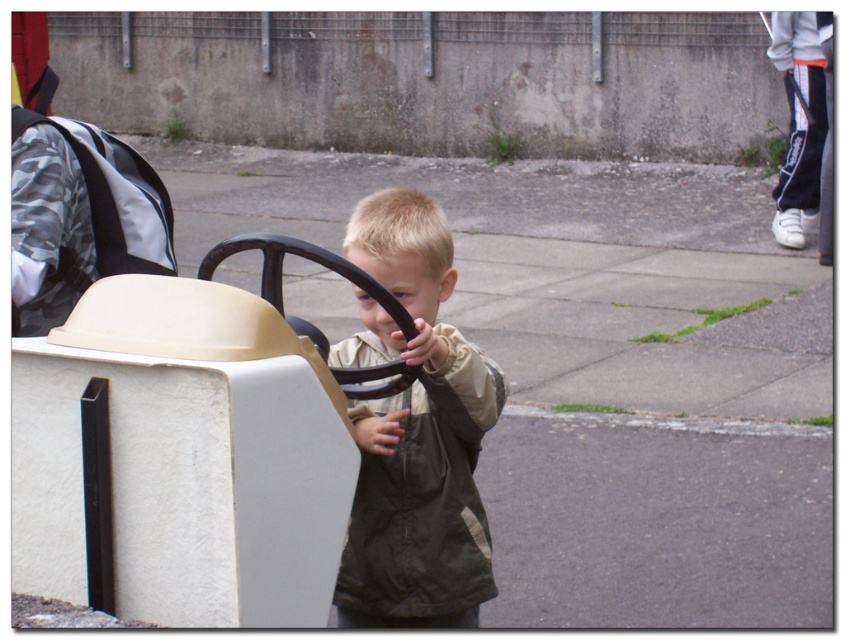
What are the coordinates of the khaki fabric jacket at center in the image?

The khaki fabric jacket at center is located at coordinates point (413, 433).